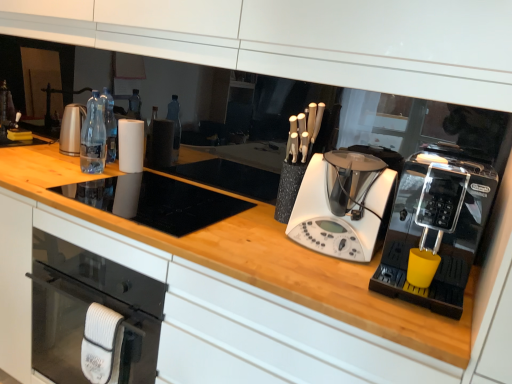
At what (x,y) coordinates should I click in order to perform the action: click on free space to the left of white plastic blender at center, which ranks as the 1th home appliance in left-to-right order. Please return your answer as a coordinate pair (x, y). Image resolution: width=512 pixels, height=384 pixels. Looking at the image, I should click on (257, 233).